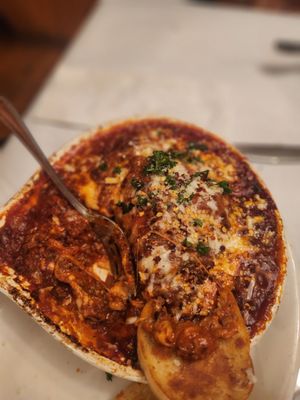
What are the coordinates of `bowl` in the screenshot? It's located at (115, 368).